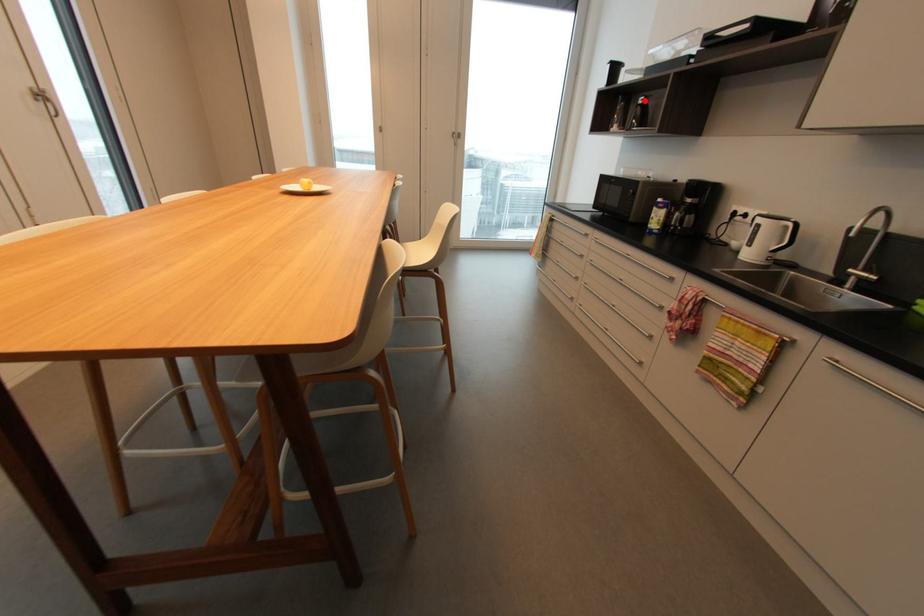
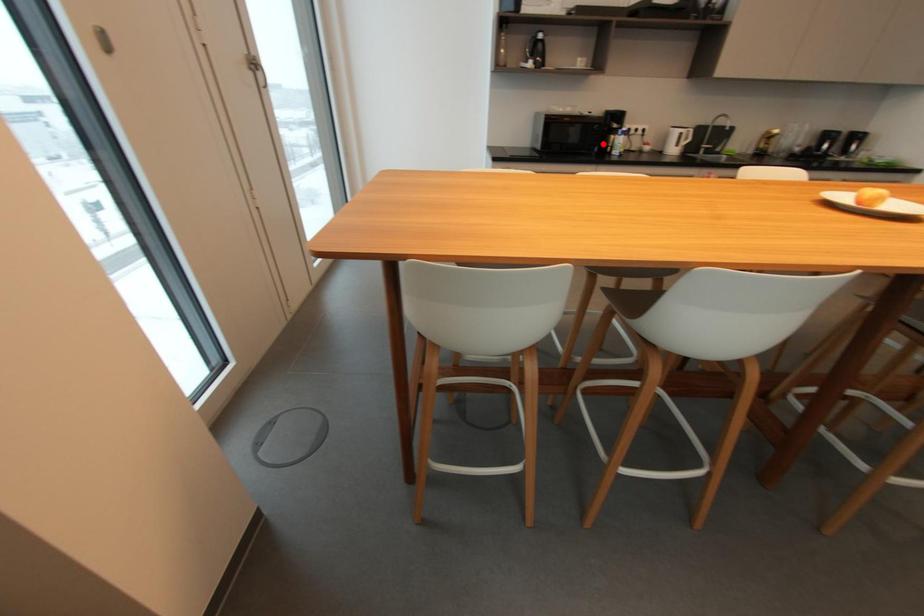
I am providing you with two images of the same scene from different viewpoints. A red point is marked on the first image and another point is marked on the second image. Is the marked point in image1 the same physical position as the marked point in image2?

No